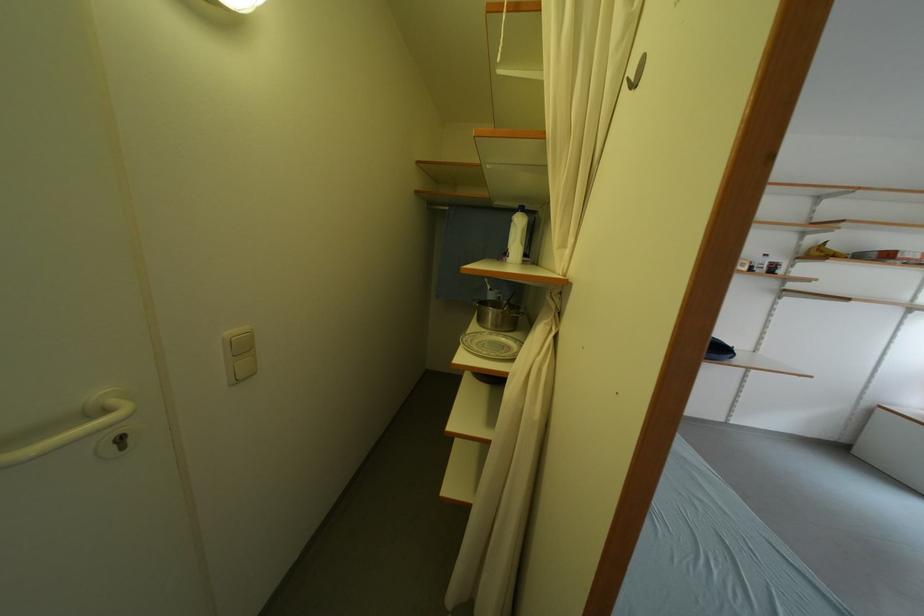
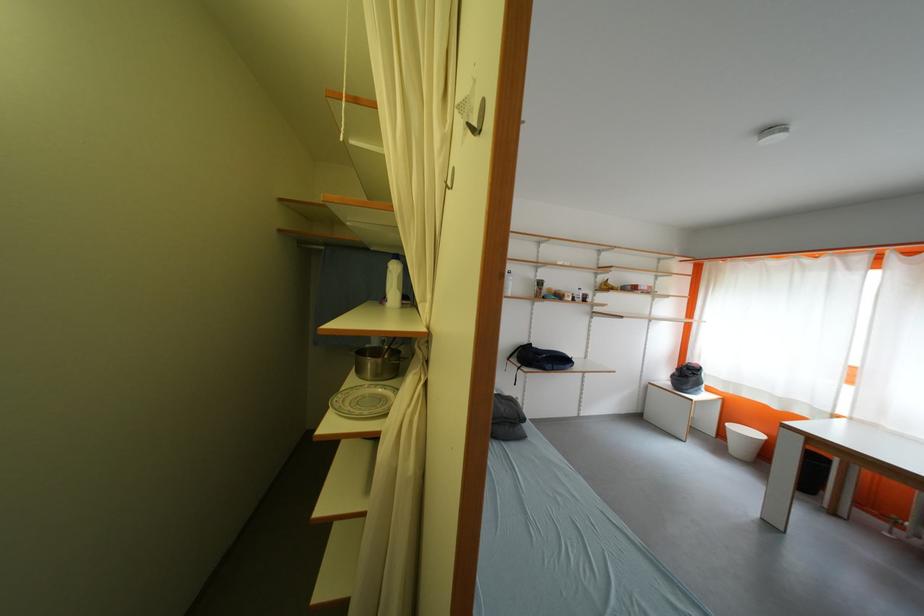
What movement of the cameraman would produce the second image?

The cameraman moved toward right, backward.